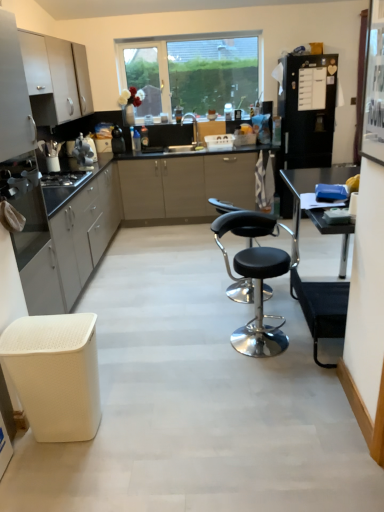
Question: Is white matte cabinet at upper left, positioned as the third cabinetry in top-to-bottom order, not within metallic silver toaster at left?

Choices:
 (A) no
 (B) yes

Answer: (B)

Question: Does white matte cabinet at upper left, which is counted as the second cabinetry, starting from the bottom, turn towards metallic silver toaster at left?

Choices:
 (A) yes
 (B) no

Answer: (B)

Question: From a real-world perspective, is white matte cabinet at upper left, positioned as the third cabinetry in top-to-bottom order, located beneath metallic silver toaster at left?

Choices:
 (A) yes
 (B) no

Answer: (B)

Question: Considering the relative positions of white matte cabinet at upper left, which is counted as the second cabinetry, starting from the bottom, and metallic silver toaster at left in the image provided, is white matte cabinet at upper left, which is counted as the second cabinetry, starting from the bottom, behind metallic silver toaster at left?

Choices:
 (A) yes
 (B) no

Answer: (A)

Question: Are white matte cabinet at upper left, which is counted as the second cabinetry, starting from the bottom, and metallic silver toaster at left located far from each other?

Choices:
 (A) no
 (B) yes

Answer: (A)

Question: In terms of width, does satin silver toaster at left, which is counted as the 2th appliance, starting from the right, look wider or thinner when compared to metallic silver toaster at left?

Choices:
 (A) wide
 (B) thin

Answer: (B)

Question: Is satin silver toaster at left, marked as the 2th appliance in a back-to-front arrangement, spatially inside metallic silver toaster at left, or outside of it?

Choices:
 (A) outside
 (B) inside

Answer: (A)

Question: Is point (81, 160) closer or farther from the camera than point (13, 173)?

Choices:
 (A) closer
 (B) farther

Answer: (B)

Question: From a real-world perspective, is satin silver toaster at left, which is the first appliance in left-to-right order, physically located above or below metallic silver toaster at left?

Choices:
 (A) below
 (B) above

Answer: (B)

Question: Is point (220, 203) positioned closer to the camera than point (82, 334)?

Choices:
 (A) farther
 (B) closer

Answer: (A)

Question: Do you think black leather stool at center, which is the 2th chair in front-to-back order, is within white textured stool at lower left, or outside of it?

Choices:
 (A) outside
 (B) inside

Answer: (A)

Question: Is black leather stool at center, which is the 2th chair in front-to-back order, to the left or to the right of white textured stool at lower left in the image?

Choices:
 (A) left
 (B) right

Answer: (B)

Question: From a real-world perspective, is black leather stool at center, the 1th chair positioned from the back, positioned above or below white textured stool at lower left?

Choices:
 (A) below
 (B) above

Answer: (B)

Question: Looking at their shapes, would you say satin white cabinets at left, which appears as the first cabinetry when viewed from the top, is wider or thinner than white textured stool at lower left?

Choices:
 (A) thin
 (B) wide

Answer: (A)

Question: Is satin white cabinets at left, which appears as the first cabinetry when viewed from the top, in front of or behind white textured stool at lower left in the image?

Choices:
 (A) behind
 (B) front

Answer: (A)